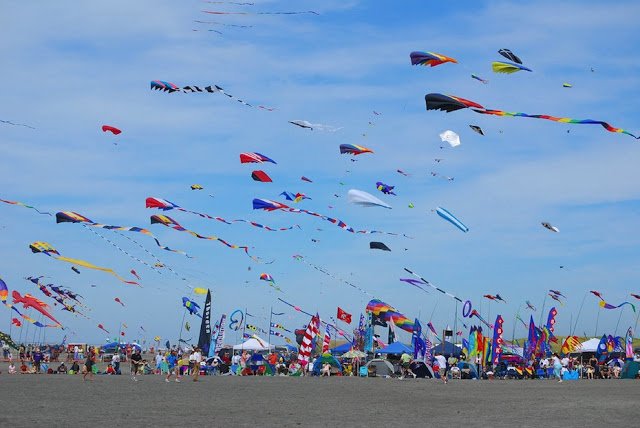
What are the coordinates of `dark blue canopy` in the screenshot? It's located at (449, 350).